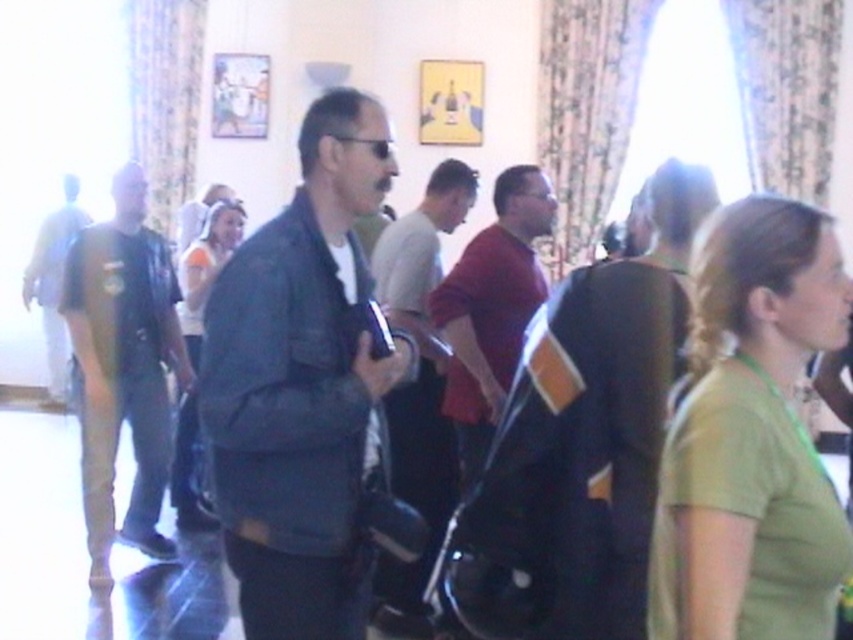
Which is more to the right, dark gray leather jacket at center or light gray fabric shirt at left?

dark gray leather jacket at center is more to the right.

This screenshot has height=640, width=853. Find the location of `dark gray leather jacket at center`. dark gray leather jacket at center is located at coordinates (300, 385).

Between point (751, 280) and point (45, 316), which one is positioned behind?

The point (45, 316) is more distant.

Does green matte shirt at center appear on the right side of light gray fabric shirt at left?

Correct, you'll find green matte shirt at center to the right of light gray fabric shirt at left.

Is point (767, 444) farther from viewer compared to point (48, 326)?

No, (767, 444) is in front of (48, 326).

Identify the location of green matte shirt at center. This screenshot has height=640, width=853. (751, 436).

Between dark gray leather jacket at center and green matte shirt at center, which one is positioned higher?

dark gray leather jacket at center is higher up.

In order to click on dark gray leather jacket at center in this screenshot , I will do `click(300, 385)`.

Find the location of a particular element. The image size is (853, 640). dark gray leather jacket at center is located at coordinates (300, 385).

Where is `dark gray leather jacket at center`? The height and width of the screenshot is (640, 853). dark gray leather jacket at center is located at coordinates (300, 385).